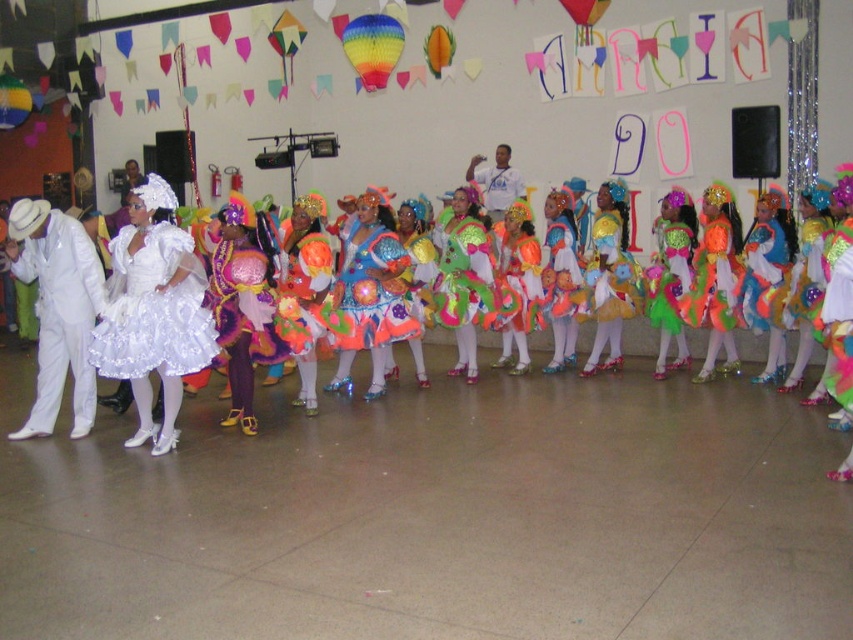
Question: Which object is the closest to the white satin suit at left?

Choices:
 (A) white satin dress at center
 (B) shiny multicolored dress at center
 (C) rainbow paper balloon at upper center

Answer: (A)

Question: Which object is positioned farthest from the white satin dress at left?

Choices:
 (A) rainbow paper balloon at upper left
 (B) rainbow paper balloon at upper center

Answer: (A)

Question: Does white satin suit at left appear on the right side of rainbow paper balloon at upper center?

Choices:
 (A) yes
 (B) no

Answer: (B)

Question: Is white satin suit at left bigger than rainbow paper balloon at upper left?

Choices:
 (A) no
 (B) yes

Answer: (B)

Question: Among these points, which one is farthest from the camera?

Choices:
 (A) (846, 230)
 (B) (90, 388)
 (C) (850, 273)
 (D) (360, 77)

Answer: (D)

Question: Is rainbow paper balloon at upper center wider than rainbow paper balloon at upper left?

Choices:
 (A) yes
 (B) no

Answer: (B)